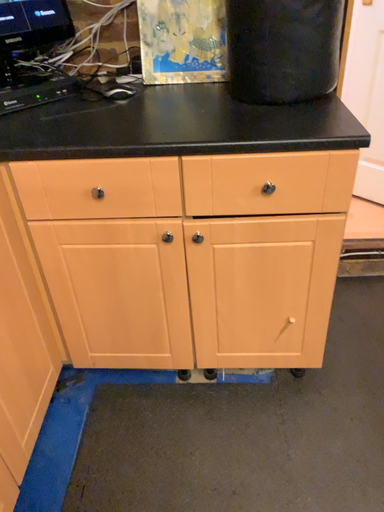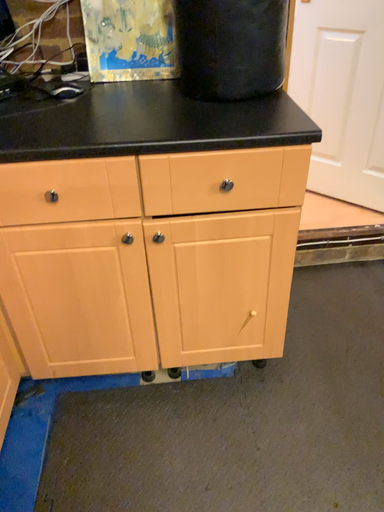
Question: Which way did the camera rotate in the video?

Choices:
 (A) rotated left
 (B) rotated right

Answer: (B)